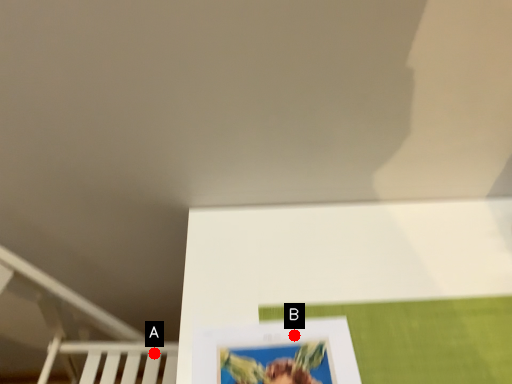
Question: Two points are circled on the image, labeled by A and B beside each circle. Which point is closer to the camera?

Choices:
 (A) A is closer
 (B) B is closer

Answer: (B)